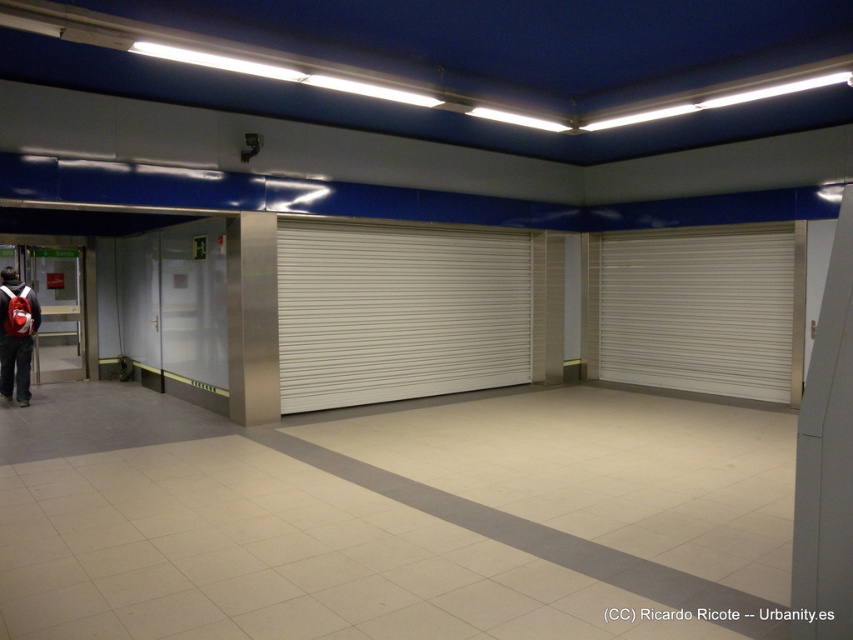
Which is above, white metallic blind at center or matte red backpack at lower left?

Positioned higher is white metallic blind at center.

Is white metallic blind at center above matte red backpack at lower left?

Indeed, white metallic blind at center is positioned over matte red backpack at lower left.

Describe the element at coordinates (398, 312) in the screenshot. I see `white metallic blind at center` at that location.

Image resolution: width=853 pixels, height=640 pixels. What are the coordinates of `white metallic blind at center` in the screenshot? It's located at (398, 312).

Is white metallic blind at center shorter than white metallic blind at right?

No.

Does white metallic blind at center have a larger size compared to white metallic blind at right?

Yes.

The image size is (853, 640). In order to click on white metallic blind at center in this screenshot , I will do `click(398, 312)`.

Find the location of a particular element. The height and width of the screenshot is (640, 853). white metallic blind at center is located at coordinates (398, 312).

Between point (653, 326) and point (9, 355), which one is positioned behind?

The point (653, 326) is more distant.

Does point (665, 241) come behind point (4, 310)?

Yes, point (665, 241) is farther from viewer.

Where is `white metallic blind at right`? The width and height of the screenshot is (853, 640). white metallic blind at right is located at coordinates (698, 310).